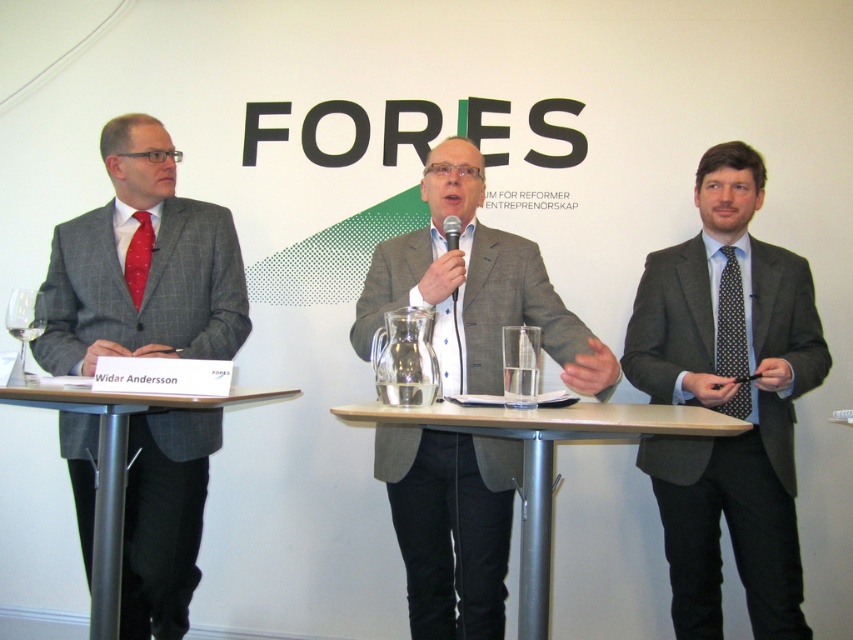
Which is behind, point (657, 348) or point (480, 419)?

The point (657, 348) is behind.

Consider the image. Does matte gray suit at right appear on the left side of wooden at center?

Incorrect, matte gray suit at right is not on the left side of wooden at center.

Is point (692, 568) more distant than point (546, 576)?

Yes, point (692, 568) is farther from viewer.

Identify the location of matte gray suit at right. (727, 400).

Is polka dot silk tie at center above red dotted tie at left?

No.

Measure the distance between polka dot silk tie at center and red dotted tie at left.

A distance of 1.65 meters exists between polka dot silk tie at center and red dotted tie at left.

What do you see at coordinates (732, 337) in the screenshot?
I see `polka dot silk tie at center` at bounding box center [732, 337].

Where is `polka dot silk tie at center`? The height and width of the screenshot is (640, 853). polka dot silk tie at center is located at coordinates (732, 337).

Looking at this image, does matte gray suit at left appear under red dotted tie at left?

Yes, matte gray suit at left is below red dotted tie at left.

Looking at this image, is matte gray suit at left positioned at the back of red dotted tie at left?

No, it is not.

Who is more distant from viewer, (56,253) or (148,228)?

Positioned behind is point (56,253).

Find the location of a particular element. matte gray suit at left is located at coordinates (149, 266).